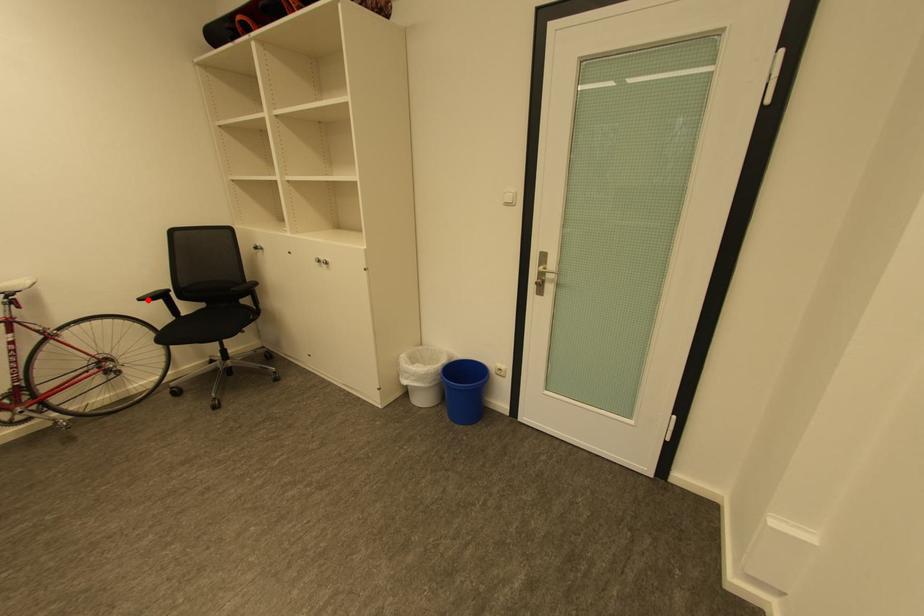
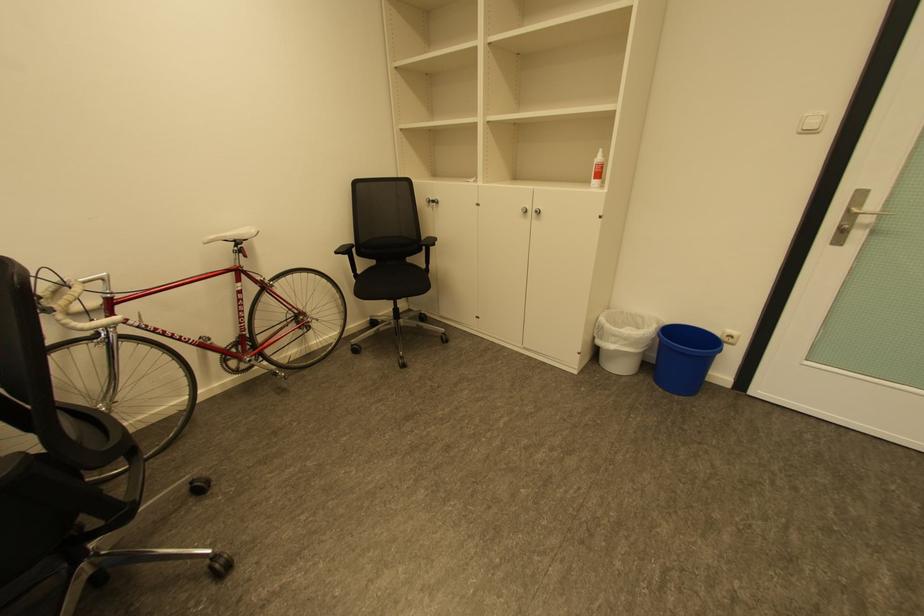
Question: I am providing you with two images of the same scene from different viewpoints. Image1 has a red point marked. In image2, the corresponding 3D location appears at what relative position? Reply with the corresponding letter.

Choices:
 (A) Closer
 (B) Farther

Answer: (A)